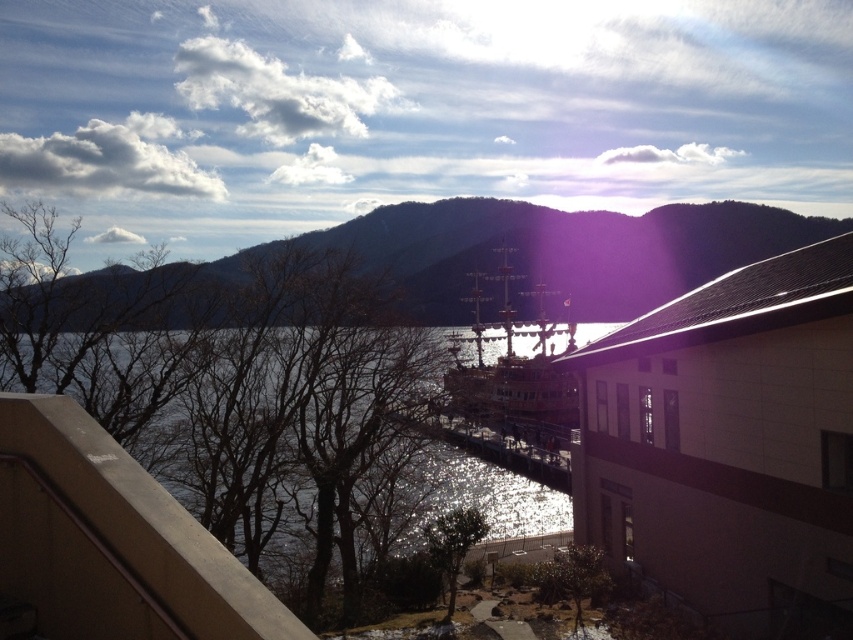
Describe the element at coordinates (552, 250) in the screenshot. I see `brown/mountainous at upper center` at that location.

Between brown/mountainous at upper center and clear water at lower left, which one has less height?

clear water at lower left

Locate an element on the screen. This screenshot has height=640, width=853. brown/mountainous at upper center is located at coordinates (552, 250).